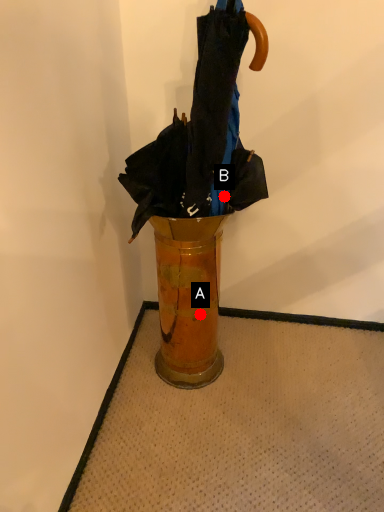
Question: Two points are circled on the image, labeled by A and B beside each circle. Which point is closer to the camera?

Choices:
 (A) A is closer
 (B) B is closer

Answer: (B)